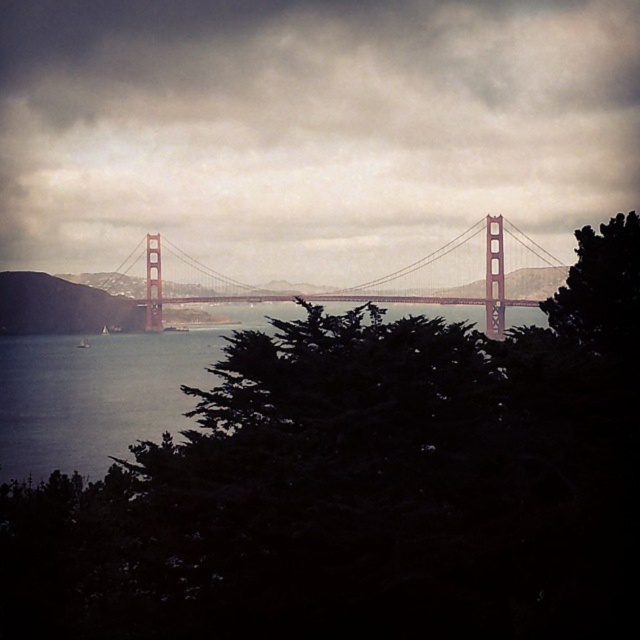
Is green leafy tree at center smaller than cloudy sky at center?

Yes.

Does green leafy tree at center appear on the right side of cloudy sky at center?

Incorrect, green leafy tree at center is not on the right side of cloudy sky at center.

The width and height of the screenshot is (640, 640). Describe the element at coordinates (365, 484) in the screenshot. I see `green leafy tree at center` at that location.

You are a GUI agent. You are given a task and a screenshot of the screen. Output one action in this format:
    pyautogui.click(x=<x>, y=<y>)
    Task: Click on the green leafy tree at center
    The height and width of the screenshot is (640, 640).
    Given the screenshot: What is the action you would take?
    pyautogui.click(x=365, y=484)

Is point (198, 28) farther from viewer compared to point (557, 285)?

Yes, it is behind point (557, 285).

This screenshot has width=640, height=640. What do you see at coordinates (308, 128) in the screenshot? I see `cloudy sky at center` at bounding box center [308, 128].

Identify the location of cloudy sky at center. The image size is (640, 640). (308, 128).

Is green leafy tree at center above metallic red bridge at center?

Incorrect, green leafy tree at center is not positioned above metallic red bridge at center.

Does green leafy tree at center have a greater height compared to metallic red bridge at center?

Yes.

You are a GUI agent. You are given a task and a screenshot of the screen. Output one action in this format:
    pyautogui.click(x=<x>, y=<y>)
    Task: Click on the green leafy tree at center
    
    Given the screenshot: What is the action you would take?
    pyautogui.click(x=365, y=484)